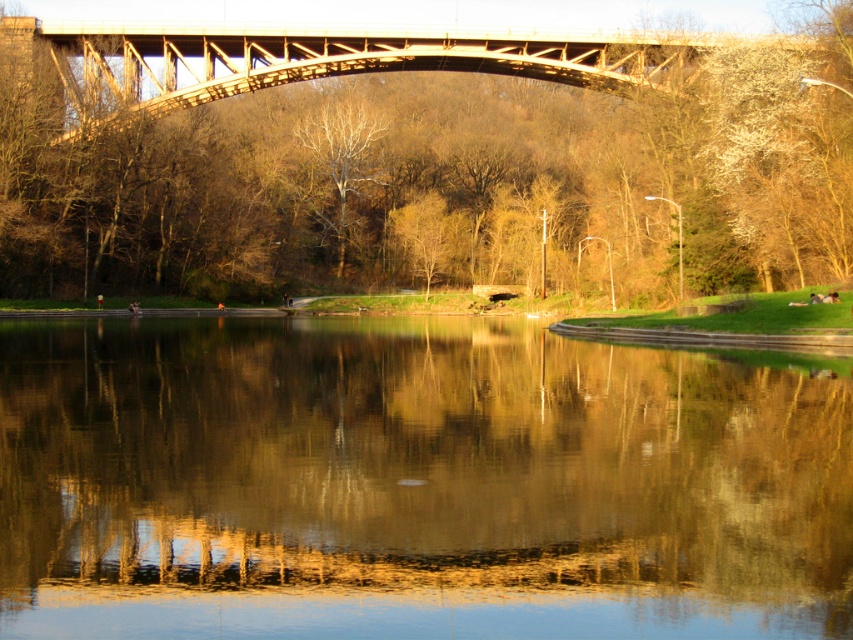
In the scene shown: You are standing at the point marked as point (413, 483) in the image. What is the object directly beneath your feet?

The smooth reflective water at center is located at point (413, 483), so the object directly beneath your feet is the smooth reflective water at center.

You are standing on the pathway and want to take a photo of both the smooth reflective water at center and the smooth brown tree at center. Which object will appear smaller in the photo?

The smooth reflective water at center will appear smaller in the photo because it is smaller than the smooth brown tree at center according to the description.

You are standing at the center of the image and want to locate the smooth reflective water at center. According to the coordinates provided, in which direction should you look to find it?

The smooth reflective water at center is located at coordinates point (x=413, y=483), so you should look towards the lower right direction from the center of the image.